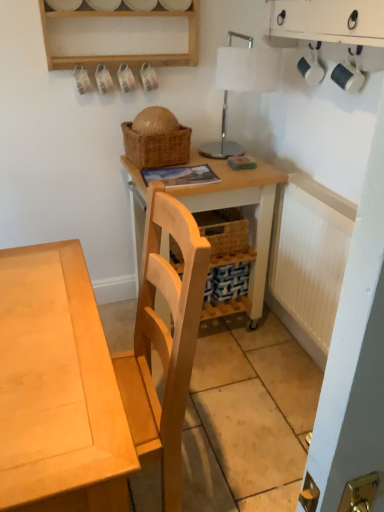
Where is `free location to the right of woven brown picnic basket at upper center`? The width and height of the screenshot is (384, 512). free location to the right of woven brown picnic basket at upper center is located at coordinates (207, 164).